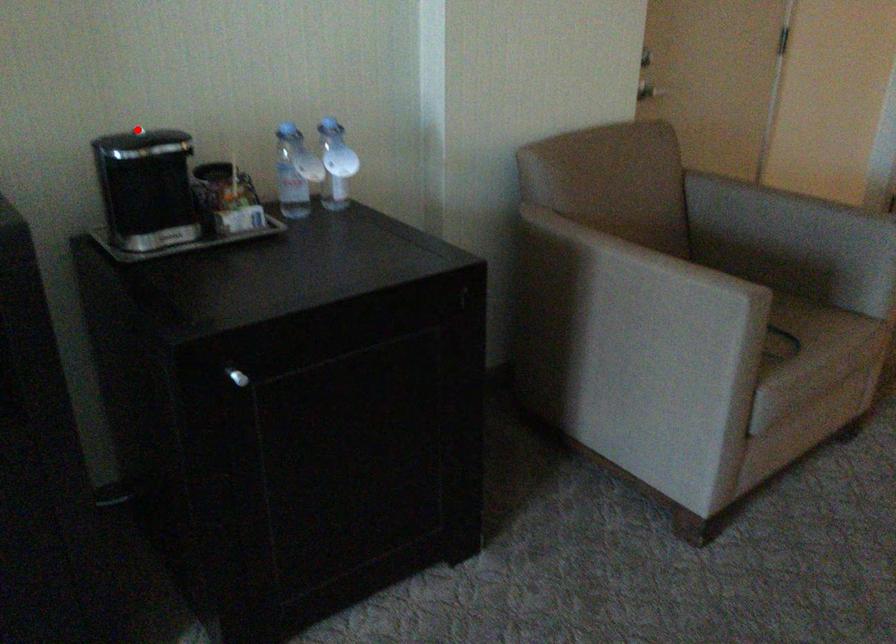
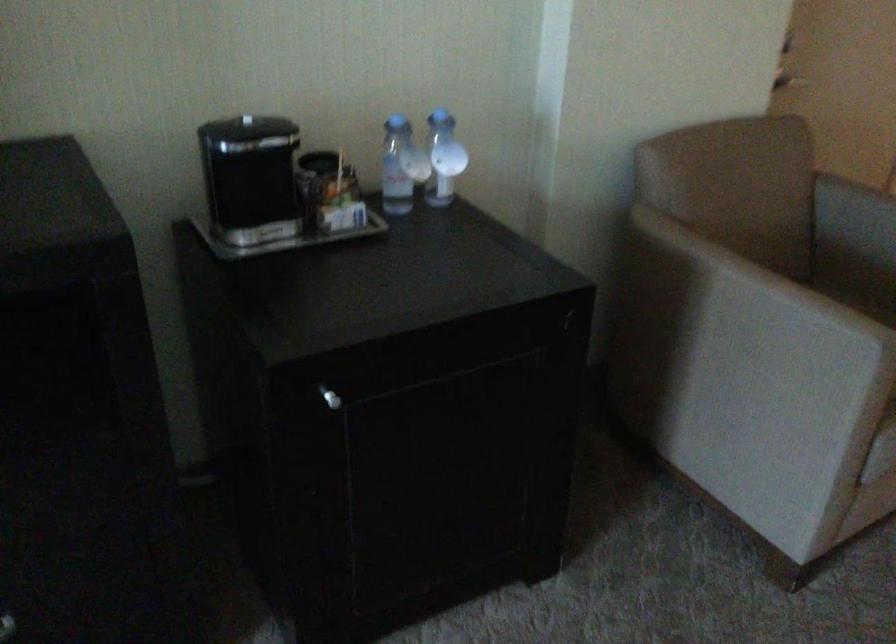
Find the pixel in the second image that matches the highlighted location in the first image.

(246, 120)